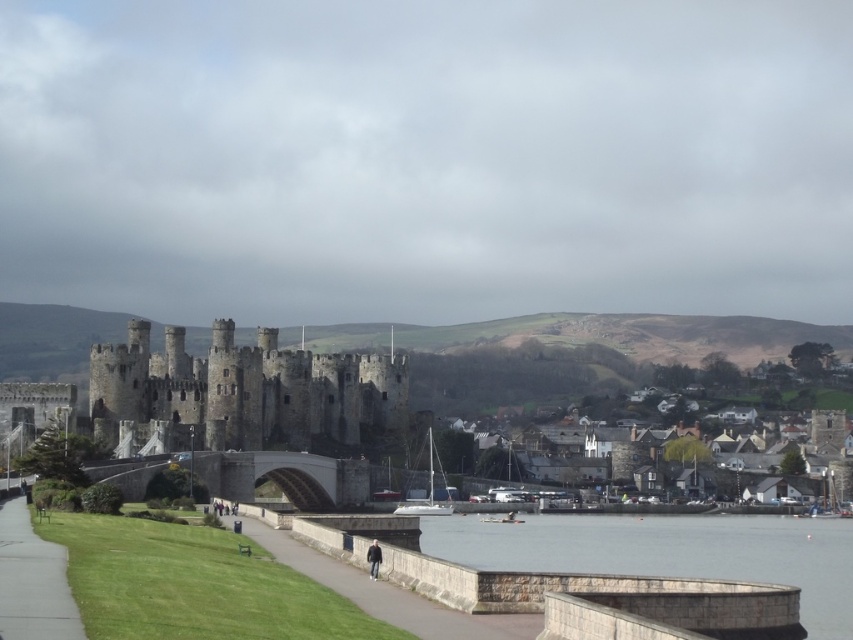
Question: Does gray stone water at lower right appear on the left side of gray concrete path at lower center?

Choices:
 (A) no
 (B) yes

Answer: (A)

Question: Can you confirm if gray concrete path at lower center is smaller than green grass at lower left?

Choices:
 (A) no
 (B) yes

Answer: (B)

Question: Which object appears closest to the camera in this image?

Choices:
 (A) gray stone water at lower right
 (B) dark gray jacket at lower center
 (C) gray concrete path at lower center

Answer: (C)

Question: Which of the following is the farthest from the observer?

Choices:
 (A) green grass at lower left
 (B) dark gray jacket at lower center
 (C) gray stone water at lower right
 (D) dark gray stone castle at center

Answer: (D)

Question: Which point is farther to the camera?

Choices:
 (A) (65, 573)
 (B) (676, 520)
 (C) (312, 381)

Answer: (C)

Question: Does gray concrete path at lower center appear on the right side of dark gray jacket at lower center?

Choices:
 (A) no
 (B) yes

Answer: (A)